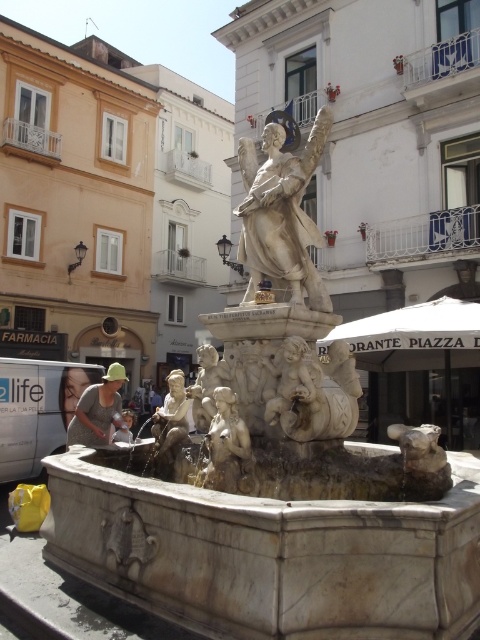
You are standing in the square and want to take a photo of the white marble statue at center. If your camera can focus on objects up to 7 meters away, will it be able to capture the statue clearly?

The white marble statue at center is 6.85 meters from camera, so yes, the camera can focus on it clearly since it is within the 7 meters range.